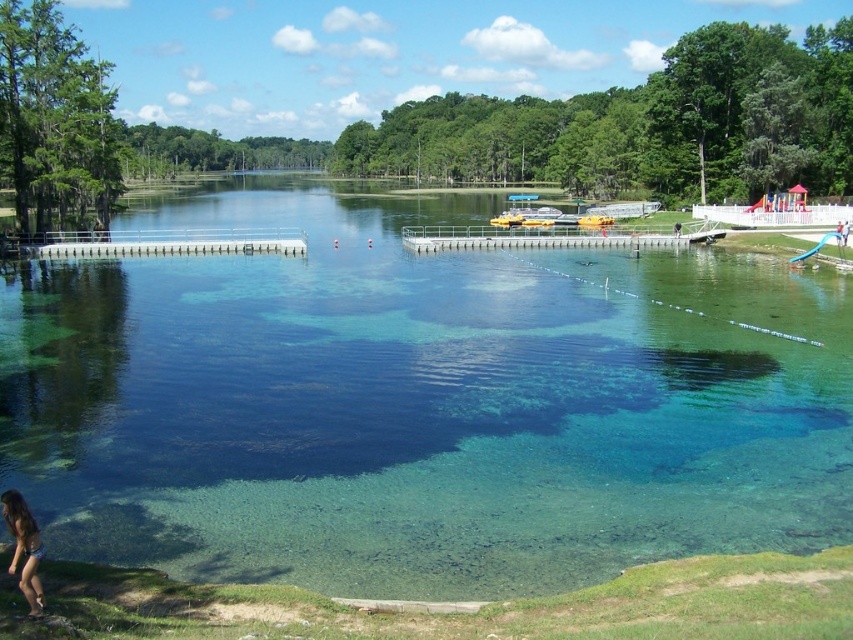
You are standing at the edge of the lake and see two points marked on the water. The first point is labeled as point [384,525] and the second is point [454,237]. Which of these two points is closer to you?

Point [384,525] is in front of point [454,237], so it is closer to you.

You are standing at the lakeside and want to walk to the point marked as point (463, 232). However, there is an obstacle at point (32, 576). Which point should you avoid stepping on to reach your destination safely?

You should avoid stepping on point (32, 576) because it is closer to you than point (463, 232), which is further away. Stepping on the closer point would block your path to the farther one.

You are planning to swim from the metallic gray dock at center to the blue bikini at lower left. Which object is farther away from you if you are at the dock?

The blue bikini at lower left is farther away because the metallic gray dock at center is larger in size, indicating it is closer to you.